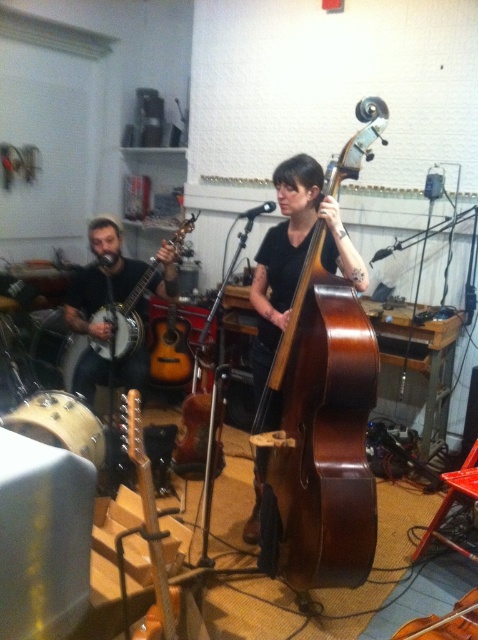
You are standing in the venue and see the point marked at coordinates (101, 280). What object is this point located on?

The point at coordinates (101, 280) is located on the matte black banjo at left.

You are a photographer setting up for a live music shoot. You want to capture the brown polished wood cello at center and the matte black banjo at left in the same frame. Which instrument should you focus on first if you want to ensure both are in focus?

The brown polished wood cello at center is located below the matte black banjo at left. To ensure both are in focus, you should focus on the matte black banjo at left first since it is farther away, as depth of field typically extends further behind the point of focus than in front.

You are a stagehand setting up for a live music performance. You need to place the brown polished wood cello at center and the matte black banjo at left on a stage that is 1.2 meters wide. Can both instruments fit side by side without overlapping?

The brown polished wood cello at center has a smaller width than the matte black banjo at left. However, since the exact widths are not provided, we cannot determine if their combined width exceeds 1.2 meters. More information is needed.